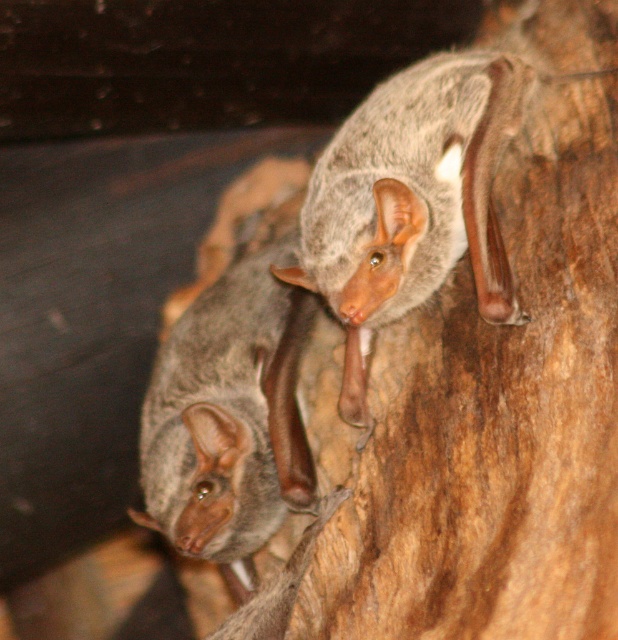
Is gray fur bat at upper right thinner than gray fur bat at lower left?

No, gray fur bat at upper right is not thinner than gray fur bat at lower left.

Can you confirm if gray fur bat at upper right is taller than gray fur bat at lower left?

No, gray fur bat at upper right is not taller than gray fur bat at lower left.

Where is `gray fur bat at upper right`? gray fur bat at upper right is located at coordinates (410, 200).